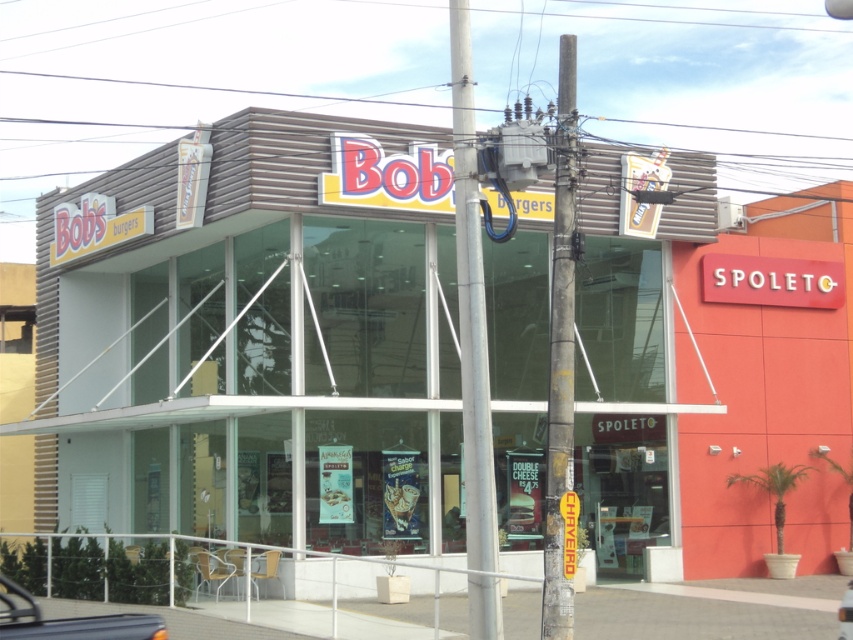
Is metallic silver car at lower left taller than metallic silver car at lower right?

Yes.

Between point (157, 636) and point (846, 595), which one is positioned behind?

The point (846, 595) is behind.

Where is `metallic silver car at lower left`? The image size is (853, 640). metallic silver car at lower left is located at coordinates (68, 621).

Which is below, matte brown building at center or rusty metal pole at center?

matte brown building at center is below.

Who is more distant from viewer, (529, 282) or (550, 323)?

Positioned behind is point (529, 282).

The height and width of the screenshot is (640, 853). Identify the location of matte brown building at center. (260, 340).

Does rusty metal pole at center appear on the left side of metallic silver car at lower left?

In fact, rusty metal pole at center is to the right of metallic silver car at lower left.

Between rusty metal pole at center and metallic silver car at lower left, which one appears on the right side from the viewer's perspective?

From the viewer's perspective, rusty metal pole at center appears more on the right side.

Is point (550, 288) closer to viewer compared to point (10, 625)?

That is False.

You are a GUI agent. You are given a task and a screenshot of the screen. Output one action in this format:
    pyautogui.click(x=<x>, y=<y>)
    Task: Click on the rusty metal pole at center
    
    Given the screenshot: What is the action you would take?
    click(x=561, y=353)